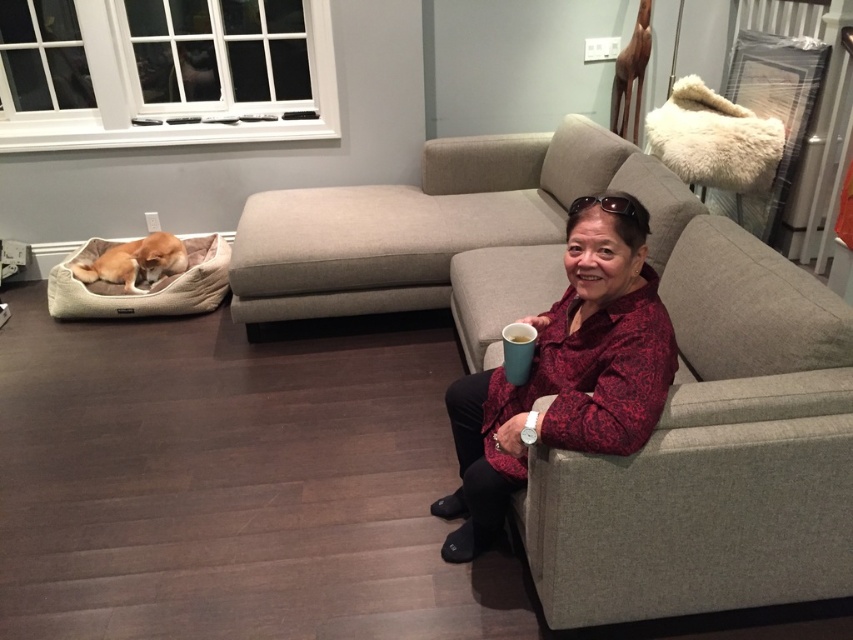
Question: Does beige fabric dog bed at lower left appear under light brown plush dog at left?

Choices:
 (A) yes
 (B) no

Answer: (A)

Question: Among these points, which one is nearest to the camera?

Choices:
 (A) tap(741, 243)
 (B) tap(589, 289)
 (C) tap(512, 380)
 (D) tap(167, 289)

Answer: (B)

Question: Among these points, which one is farthest from the camera?

Choices:
 (A) (646, 193)
 (B) (489, 422)
 (C) (532, 353)
 (D) (120, 252)

Answer: (D)

Question: Does beige fabric dog bed at lower left have a larger size compared to teal ceramic mug at upper right?

Choices:
 (A) no
 (B) yes

Answer: (B)

Question: Which point appears farthest from the camera in this image?

Choices:
 (A) (653, 589)
 (B) (511, 340)

Answer: (B)

Question: Does matte gray couch at center have a larger size compared to light brown plush dog at left?

Choices:
 (A) yes
 (B) no

Answer: (A)